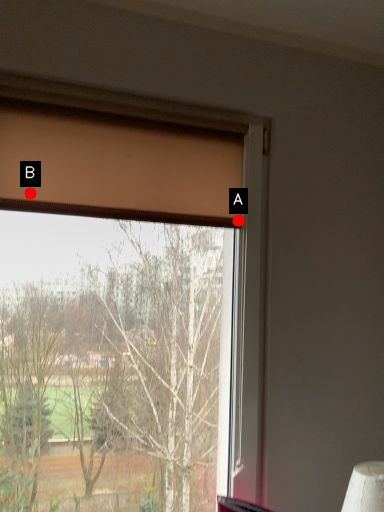
Question: Two points are circled on the image, labeled by A and B beside each circle. Which point is closer to the camera?

Choices:
 (A) A is closer
 (B) B is closer

Answer: (B)